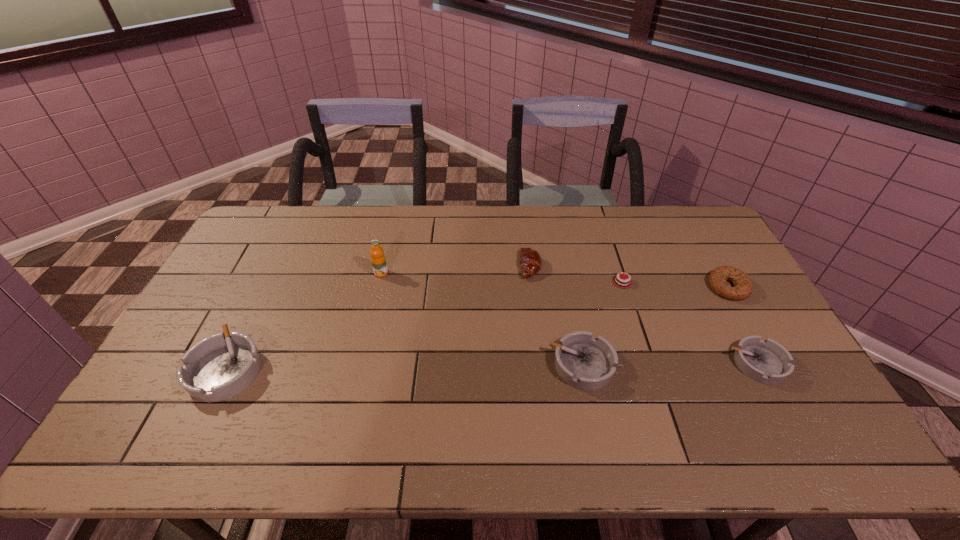
I want to click on vacant position in the image that satisfies the following two spatial constraints: 1. on the front side of the shortest ashtray; 2. on the right side of the crescent roll, so pos(541,364).

Locate an element on the screen. This screenshot has height=540, width=960. vacant region that satisfies the following two spatial constraints: 1. on the label of the tallest object; 2. on the left side of the second tallest ashtray is located at coordinates (360, 365).